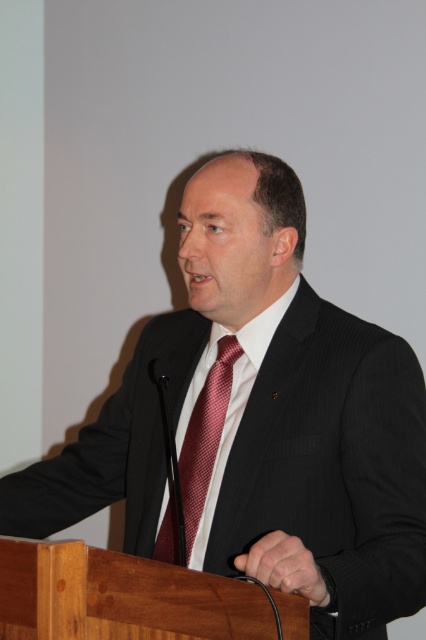
Between white smooth dress shirt at center and shiny red tie at center, which one appears on the right side from the viewer's perspective?

white smooth dress shirt at center is more to the right.

Can you confirm if white smooth dress shirt at center is taller than shiny red tie at center?

Indeed, white smooth dress shirt at center has a greater height compared to shiny red tie at center.

The image size is (426, 640). Describe the element at coordinates (229, 401) in the screenshot. I see `white smooth dress shirt at center` at that location.

Locate an element on the screen. This screenshot has height=640, width=426. white smooth dress shirt at center is located at coordinates (229, 401).